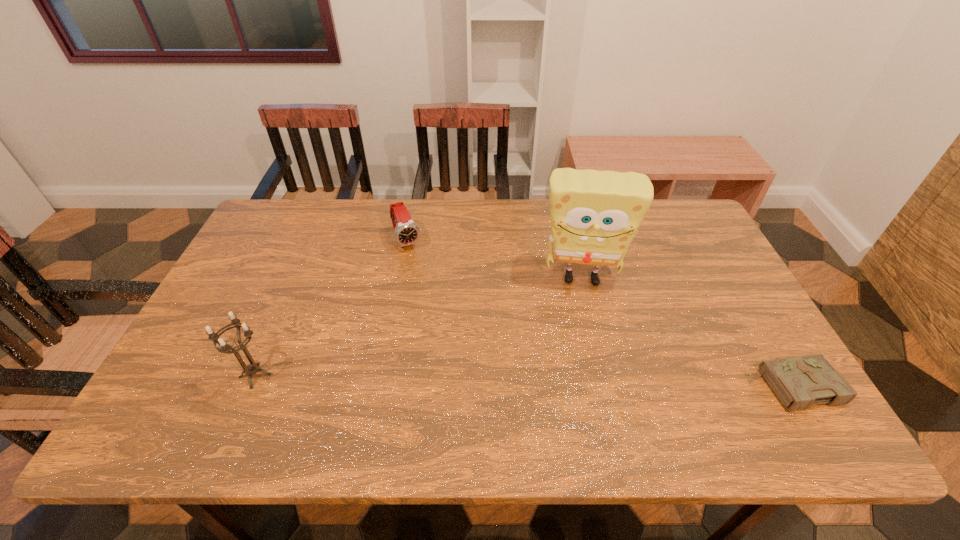
Identify the location of object at the near left corner. The width and height of the screenshot is (960, 540). (251, 369).

At what (x,y) coordinates should I click in order to perform the action: click on object that is at the near right corner. Please return your answer as a coordinate pair (x, y). Looking at the image, I should click on (798, 382).

You are a GUI agent. You are given a task and a screenshot of the screen. Output one action in this format:
    pyautogui.click(x=<x>, y=<y>)
    Task: Click on the vacant space at the far edge of the desktop
    
    Given the screenshot: What is the action you would take?
    pyautogui.click(x=540, y=218)

Locate an element on the screen. vacant space at the near edge of the desktop is located at coordinates (431, 379).

In the image, there is a desktop. Identify the location of free space at the left edge. (x=268, y=245).

In the image, there is a desktop. In order to click on free region at the right edge in this screenshot , I will do `click(705, 340)`.

Where is `empty space that is in between the farthest object and the candle holder`? empty space that is in between the farthest object and the candle holder is located at coordinates (331, 308).

Find the location of a particular element. free space between the rightmost object and the second object from right to left is located at coordinates (686, 332).

At what (x,y) coordinates should I click in order to perform the action: click on empty space that is in between the watch and the second tallest object. Please return your answer as a coordinate pair (x, y). Looking at the image, I should click on (331, 308).

Image resolution: width=960 pixels, height=540 pixels. Find the location of `vacant space that's between the leftmost object and the rightmost object`. vacant space that's between the leftmost object and the rightmost object is located at coordinates (523, 381).